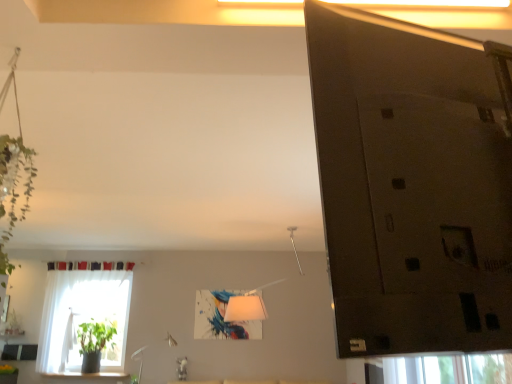
Question: Is white sheer curtain at left shorter than green matte plant at lower left?

Choices:
 (A) yes
 (B) no

Answer: (B)

Question: Is white sheer curtain at left looking in the opposite direction of green matte plant at lower left?

Choices:
 (A) no
 (B) yes

Answer: (B)

Question: Is white sheer curtain at left smaller than green matte plant at lower left?

Choices:
 (A) yes
 (B) no

Answer: (B)

Question: Does white sheer curtain at left have a greater height compared to green matte plant at lower left?

Choices:
 (A) yes
 (B) no

Answer: (A)

Question: Can you confirm if white sheer curtain at left is thinner than green matte plant at lower left?

Choices:
 (A) no
 (B) yes

Answer: (B)

Question: Does white sheer curtain at left appear on the left side of green matte plant at lower left?

Choices:
 (A) yes
 (B) no

Answer: (A)

Question: Could white sheer curtain at left be considered to be inside green matte plant at lower left?

Choices:
 (A) yes
 (B) no

Answer: (B)

Question: Is green matte plant at lower left outside white sheer curtain at left?

Choices:
 (A) yes
 (B) no

Answer: (B)

Question: Is green matte plant at lower left at the right side of white sheer curtain at left?

Choices:
 (A) yes
 (B) no

Answer: (A)

Question: From a real-world perspective, is green matte plant at lower left below white sheer curtain at left?

Choices:
 (A) yes
 (B) no

Answer: (A)

Question: Is green matte plant at lower left touching white sheer curtain at left?

Choices:
 (A) yes
 (B) no

Answer: (B)

Question: Is green matte plant at lower left oriented away from white sheer curtain at left?

Choices:
 (A) no
 (B) yes

Answer: (A)

Question: From the image's perspective, relative to white sheer curtain at left, is green matte plant at lower left above or below?

Choices:
 (A) above
 (B) below

Answer: (B)